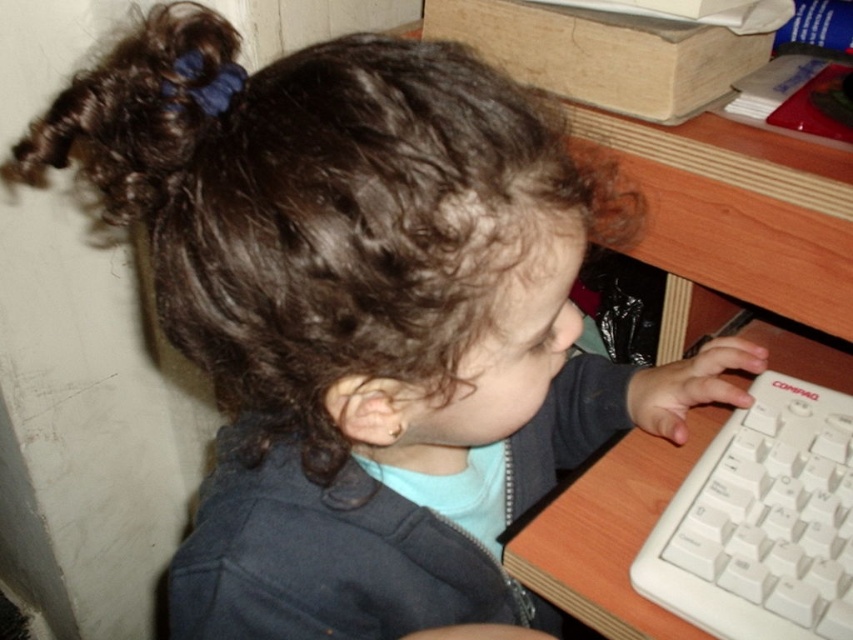
You are a parent trying to ensure your child stays focused on their homework. The child is sitting at a desk with a white plastic keyboard at right and dark curly hair at upper left. If you want to place a reminder note between these two items, will there be enough space?

The distance between the white plastic keyboard at right and dark curly hair at upper left is 42.28 centimeters, so there is sufficient space to place a reminder note between them.

You are a photographer trying to capture the child interacting with the keyboard. To ensure both the white plastic keyboard at right and the dark curly hair at upper left are in the frame, where should you position the camera relative to the child?

Position the camera to the left of the child so that the white plastic keyboard at right is on the right side of the frame and the dark curly hair at upper left remains visible on the left side. This placement ensures both objects are included in the shot as the keyboard is already on the right side of the dark curly hair at upper left.

You are a photographer standing at the center of the room. You want to take a closeup shot of the white plastic keyboard at right. According to the coordinates provided, where should you position your camera relative to the keyboard?

The white plastic keyboard at right is located at coordinates point (762, 522). To take a closeup shot, position your camera directly facing the keyboard at those coordinates.